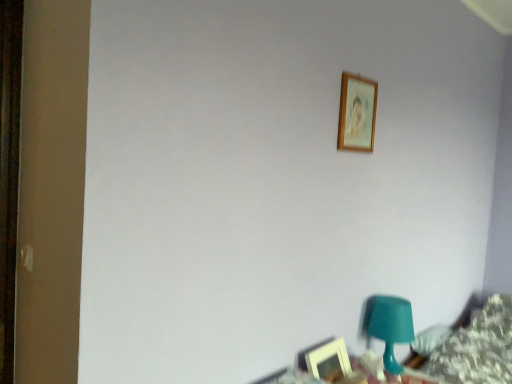
Question: Is wooden picture frame at upper center, which appears as the first picture frame when viewed from the top, surrounding teal plastic table at lower right?

Choices:
 (A) no
 (B) yes

Answer: (A)

Question: From a real-world perspective, is wooden picture frame at upper center, which appears as the first picture frame when viewed from the top, located higher than teal plastic table at lower right?

Choices:
 (A) yes
 (B) no

Answer: (A)

Question: Is wooden picture frame at upper center, the 2th picture frame in the bottom-to-top sequence, closer to the viewer compared to teal plastic table at lower right?

Choices:
 (A) yes
 (B) no

Answer: (B)

Question: Considering the relative sizes of wooden picture frame at upper center, which appears as the first picture frame when viewed from the top, and teal plastic table at lower right in the image provided, is wooden picture frame at upper center, which appears as the first picture frame when viewed from the top, taller than teal plastic table at lower right?

Choices:
 (A) no
 (B) yes

Answer: (B)

Question: From the image's perspective, is wooden picture frame at upper center, the 2th picture frame in the bottom-to-top sequence, under teal plastic table at lower right?

Choices:
 (A) yes
 (B) no

Answer: (B)

Question: Is teal plastic table at lower right inside or outside of wooden picture frame at upper center, which appears as the first picture frame when viewed from the top?

Choices:
 (A) outside
 (B) inside

Answer: (A)

Question: Is teal plastic table at lower right wider or thinner than wooden picture frame at upper center, the 2th picture frame in the bottom-to-top sequence?

Choices:
 (A) wide
 (B) thin

Answer: (A)

Question: From a real-world perspective, is teal plastic table at lower right positioned above or below wooden picture frame at upper center, which appears as the first picture frame when viewed from the top?

Choices:
 (A) below
 (B) above

Answer: (A)

Question: From their relative heights in the image, would you say teal plastic table at lower right is taller or shorter than wooden picture frame at upper center, the 2th picture frame in the bottom-to-top sequence?

Choices:
 (A) short
 (B) tall

Answer: (A)

Question: From a real-world perspective, is wooden picture frame at lower right, placed as the first picture frame when sorted from bottom to top, above or below teal plastic table at lower right?

Choices:
 (A) below
 (B) above

Answer: (B)

Question: Considering the positions of wooden picture frame at lower right, placed as the first picture frame when sorted from bottom to top, and teal plastic table at lower right in the image, is wooden picture frame at lower right, placed as the first picture frame when sorted from bottom to top, wider or thinner than teal plastic table at lower right?

Choices:
 (A) wide
 (B) thin

Answer: (B)

Question: In the image, is wooden picture frame at lower right, placed as the first picture frame when sorted from bottom to top, positioned in front of or behind teal plastic table at lower right?

Choices:
 (A) behind
 (B) front

Answer: (A)

Question: Based on their sizes in the image, would you say wooden picture frame at lower right, which ranks as the second picture frame in top-to-bottom order, is bigger or smaller than teal plastic table at lower right?

Choices:
 (A) small
 (B) big

Answer: (A)

Question: Is wooden picture frame at upper center, which appears as the first picture frame when viewed from the top, bigger or smaller than wooden picture frame at lower right, which ranks as the second picture frame in top-to-bottom order?

Choices:
 (A) big
 (B) small

Answer: (B)

Question: Considering the positions of wooden picture frame at upper center, which appears as the first picture frame when viewed from the top, and wooden picture frame at lower right, which ranks as the second picture frame in top-to-bottom order, in the image, is wooden picture frame at upper center, which appears as the first picture frame when viewed from the top, wider or thinner than wooden picture frame at lower right, which ranks as the second picture frame in top-to-bottom order,?

Choices:
 (A) wide
 (B) thin

Answer: (B)